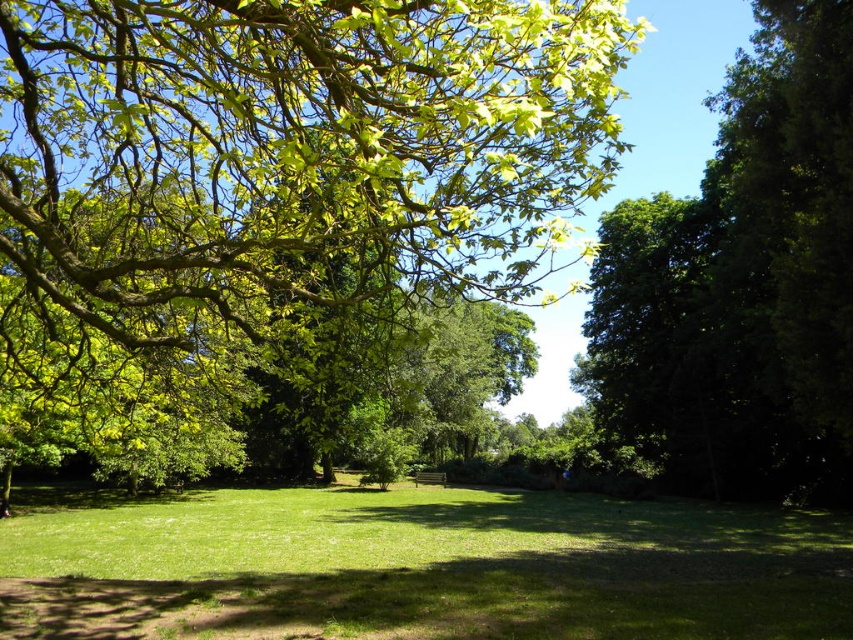
You are standing at the point with coordinates 0.5, 0.5 in this park scene. You want to walk to the green grassy field at center. Which direction should you move in to reach it?

The green grassy field at center is located at coordinates (418, 566). Since you are at (426, 320), you should move to the right to reach it.

You are standing at the point with coordinates point (722, 216) and want to walk to the point with coordinates point (560, 529). Which direction should you move to reach your destination?

To reach point (560, 529) from point (722, 216), you should move towards the direction where point (560, 529) is located, which is in front of your current position at point (722, 216).